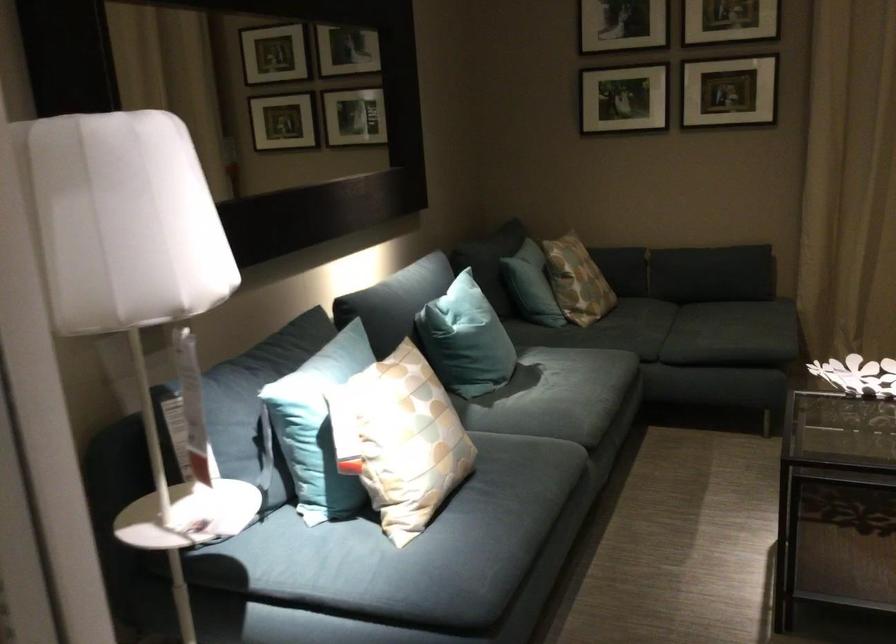
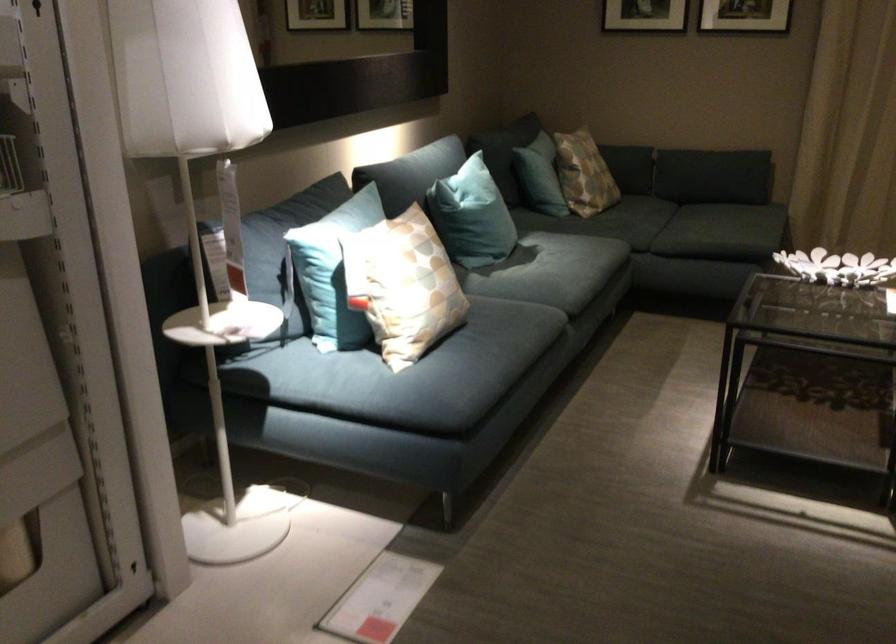
Where in the second image is the point corresponding to [463,343] from the first image?

(471, 216)